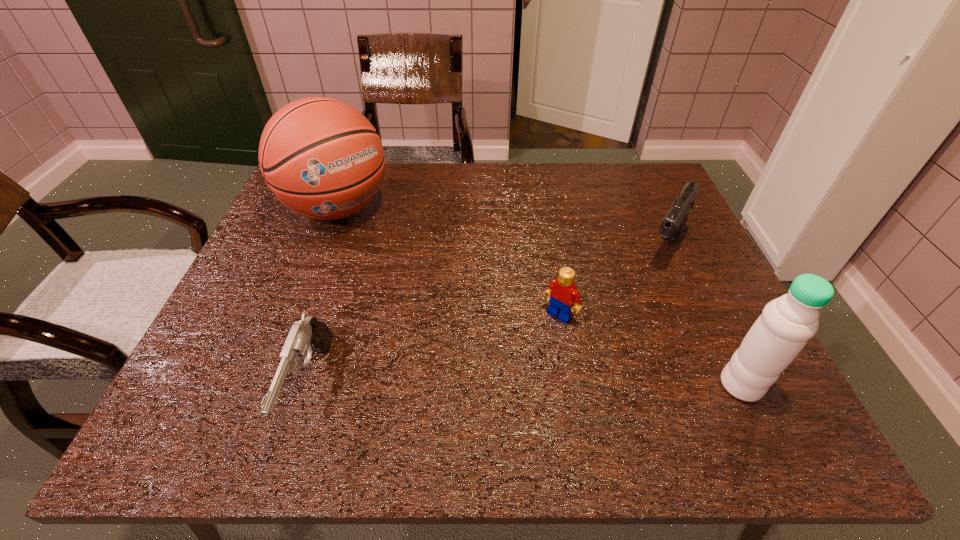
At what (x,y) coordinates should I click in order to perform the action: click on vacant region located 0.150m on the front-facing side of the Lego. Please return your answer as a coordinate pair (x, y). This screenshot has height=540, width=960. Looking at the image, I should click on (509, 370).

This screenshot has height=540, width=960. I want to click on vacant area situated on the front-facing side of the Lego, so pyautogui.click(x=492, y=388).

At what (x,y) coordinates should I click in order to perform the action: click on vacant space located 0.160m on the front-facing side of the Lego. Please return your answer as a coordinate pair (x, y). The image size is (960, 540). Looking at the image, I should click on (505, 374).

This screenshot has width=960, height=540. Find the location of `vacant region located on the logo side of the basketball`. vacant region located on the logo side of the basketball is located at coordinates (x=373, y=245).

Identify the location of blank space located 0.050m on the logo side of the basketball. The width and height of the screenshot is (960, 540). (373, 245).

Identify the location of vacant area situated on the logo side of the basketball. The width and height of the screenshot is (960, 540). (392, 264).

Locate an element on the screen. This screenshot has height=540, width=960. object that is at the far edge is located at coordinates click(x=320, y=157).

In order to click on gun positioned at the near edge in this screenshot , I will do `click(309, 334)`.

Identify the location of water bottle located in the near edge section of the desktop. The width and height of the screenshot is (960, 540). (786, 324).

Locate an element on the screen. The image size is (960, 540). object situated at the left edge is located at coordinates (320, 157).